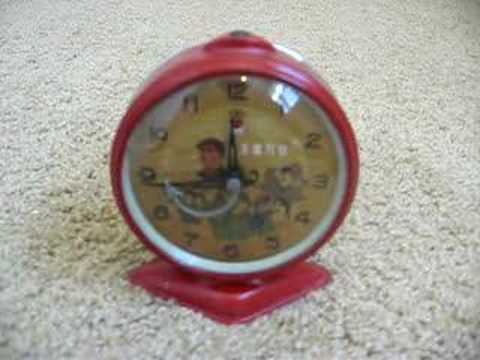
Find the location of `floor`. floor is located at coordinates [408, 179].